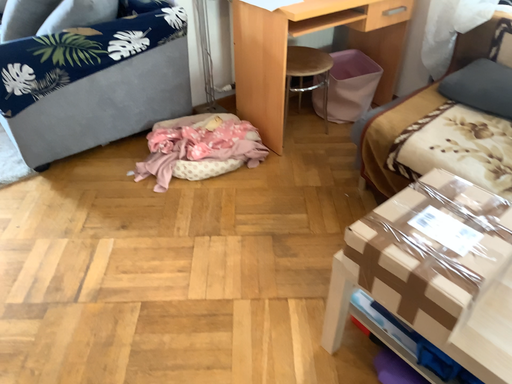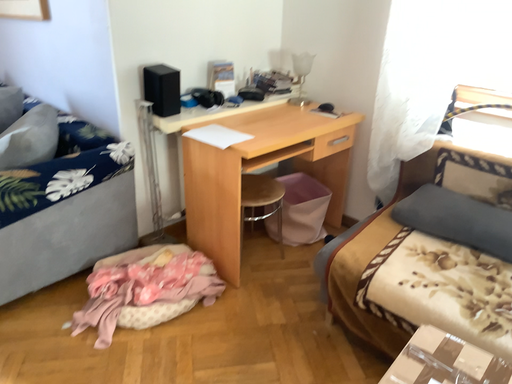
Question: Which way did the camera rotate in the video?

Choices:
 (A) rotated left
 (B) rotated right

Answer: (B)